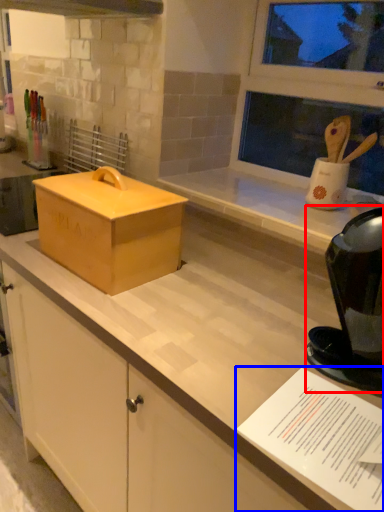
Question: Which object is closer to the camera taking this photo, appliance (highlighted by a red box) or paper (highlighted by a blue box)?

Choices:
 (A) appliance
 (B) paper

Answer: (B)